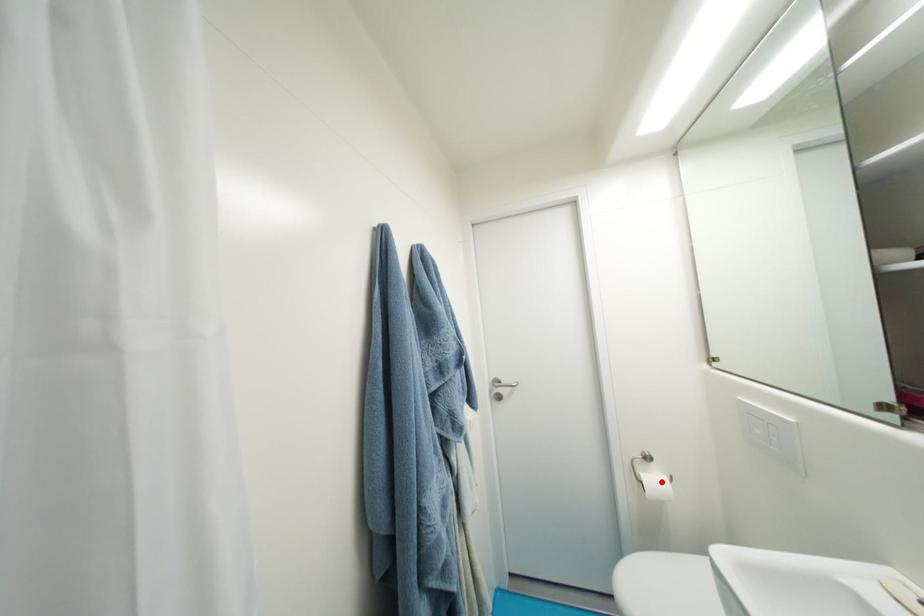
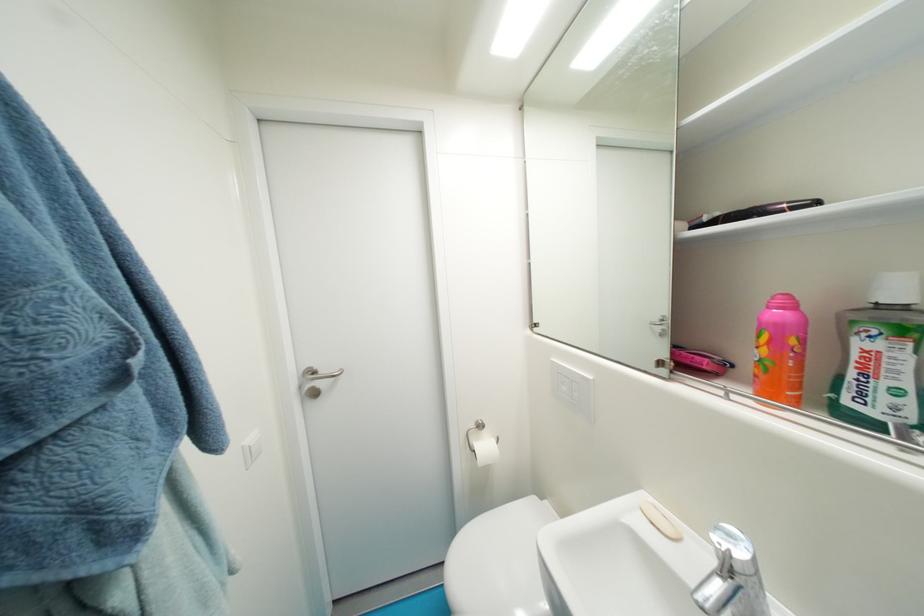
Question: I am providing you with two images of the same scene from different viewpoints. A red point is shown in image1. For the corresponding object point in image2, is it positioned nearer or farther from the camera?

Choices:
 (A) Nearer
 (B) Farther

Answer: (B)